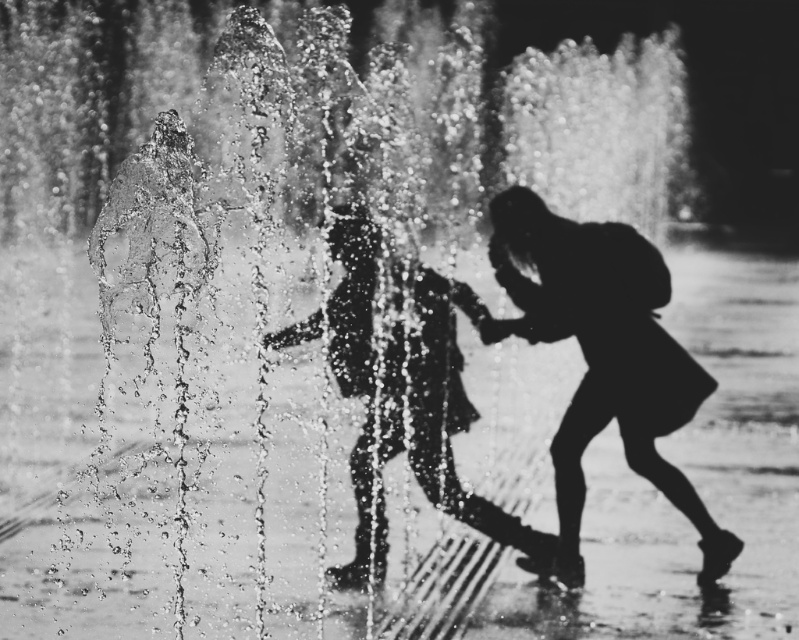
Between point (575, 474) and point (428, 476), which one is positioned in front?

Point (428, 476) is in front.

Where is `silhouette dress at lower right`? The width and height of the screenshot is (799, 640). silhouette dress at lower right is located at coordinates (603, 356).